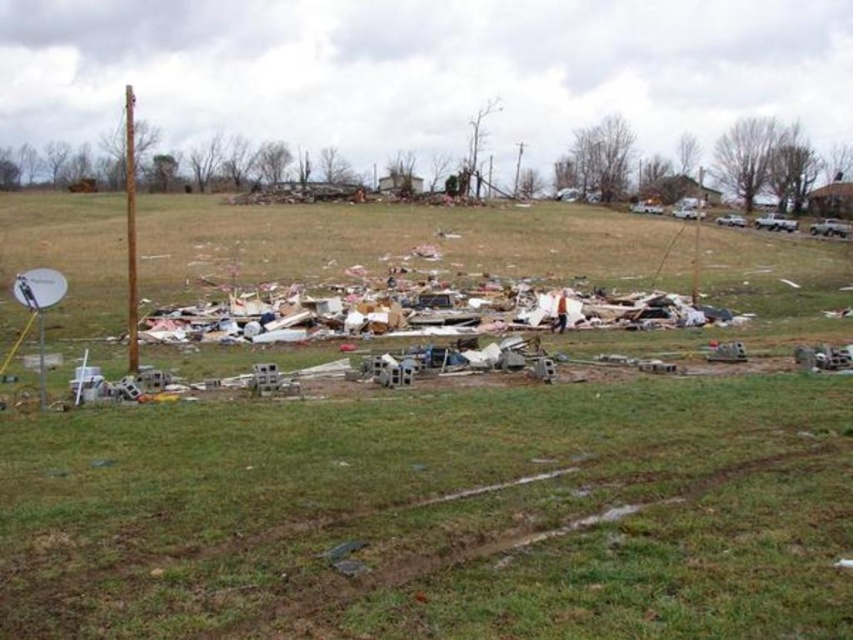
You are standing in the open field and want to walk towards the green grass at center. Which direction should you head relative to the rusty metal pole at left?

The green grass at center is closer to the viewer than the rusty metal pole at left, so you should head towards the center, which is in the opposite direction of the rusty metal pole at left.

You are a rescue worker assessing the damage in the field. You see the green grass at center and the rusty metal pole at left. Which object is closer to the ground?

The green grass at center is located below the rusty metal pole at left, so it is closer to the ground.